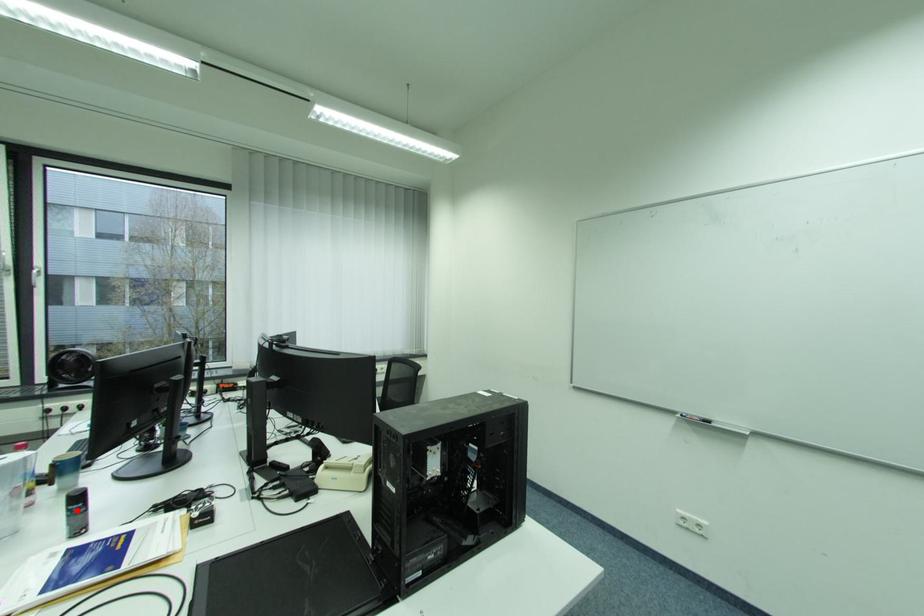
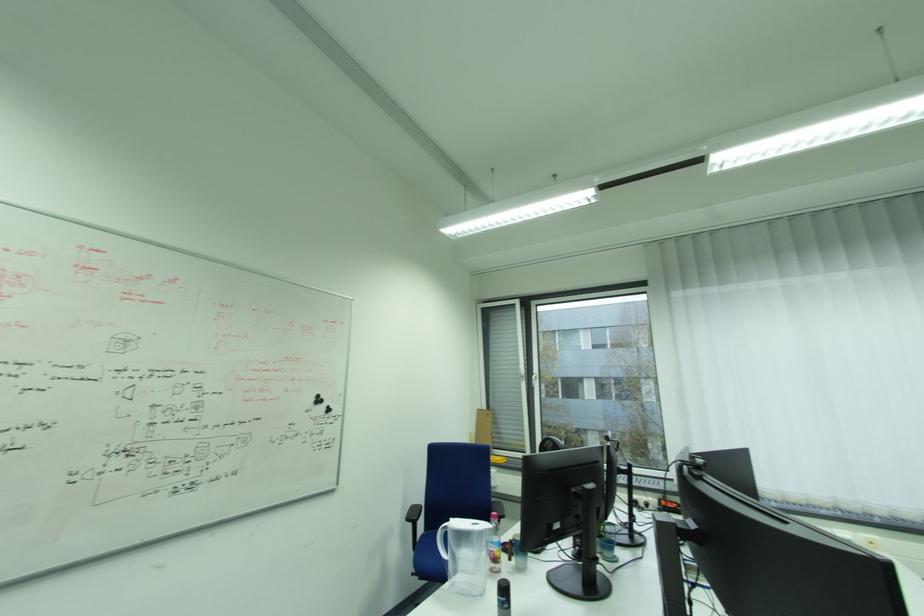
Locate, in the second image, the point that corresponds to the highlighted location in the first image.

(505, 600)